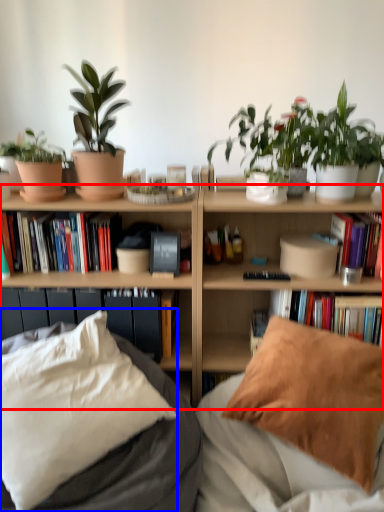
Question: Which object appears closest to the camera in this image, bookcase (highlighted by a red box) or pillow (highlighted by a blue box)?

Choices:
 (A) bookcase
 (B) pillow

Answer: (B)